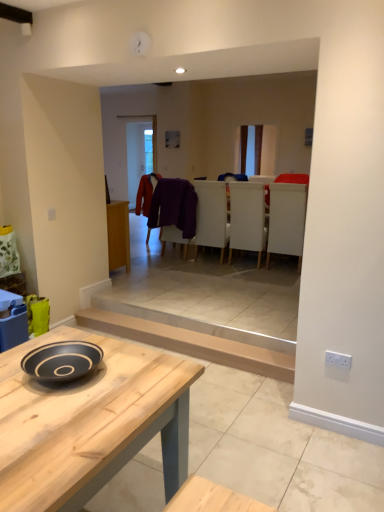
Question: From the image's perspective, does white fabric armchair at center, which is counted as the 2th armchair, starting from the left, appear higher than light brown wooden plank at lower center?

Choices:
 (A) no
 (B) yes

Answer: (B)

Question: Is white fabric armchair at center, which is counted as the 2th armchair, starting from the left, oriented away from light brown wooden plank at lower center?

Choices:
 (A) no
 (B) yes

Answer: (B)

Question: Is white fabric armchair at center, the 1th armchair from the right, further to camera compared to light brown wooden plank at lower center?

Choices:
 (A) no
 (B) yes

Answer: (B)

Question: Does white fabric armchair at center, the 1th armchair from the right, have a greater width compared to light brown wooden plank at lower center?

Choices:
 (A) no
 (B) yes

Answer: (B)

Question: Are white fabric armchair at center, which is counted as the 2th armchair, starting from the left, and light brown wooden plank at lower center located far from each other?

Choices:
 (A) no
 (B) yes

Answer: (B)

Question: Considering the positions of white matte chair at center and natural wood table at center in the image, is white matte chair at center taller or shorter than natural wood table at center?

Choices:
 (A) short
 (B) tall

Answer: (B)

Question: Is white matte chair at center spatially inside natural wood table at center, or outside of it?

Choices:
 (A) outside
 (B) inside

Answer: (A)

Question: From a real-world perspective, is white matte chair at center physically located above or below natural wood table at center?

Choices:
 (A) below
 (B) above

Answer: (B)

Question: Is white matte chair at center wider or thinner than natural wood table at center?

Choices:
 (A) wide
 (B) thin

Answer: (B)

Question: From the image's perspective, is light brown wooden plank at lower center positioned above or below natural wood table at center?

Choices:
 (A) below
 (B) above

Answer: (B)

Question: Based on their sizes in the image, would you say light brown wooden plank at lower center is bigger or smaller than natural wood table at center?

Choices:
 (A) small
 (B) big

Answer: (A)

Question: In the image, is light brown wooden plank at lower center on the left side or the right side of natural wood table at center?

Choices:
 (A) left
 (B) right

Answer: (B)

Question: Considering the positions of light brown wooden plank at lower center and natural wood table at center in the image, is light brown wooden plank at lower center taller or shorter than natural wood table at center?

Choices:
 (A) tall
 (B) short

Answer: (B)

Question: Considering their positions, is velvet red coat at center, the first laundry positioned from the back, located in front of or behind white fabric armchair at center, which is counted as the 2th armchair, starting from the left?

Choices:
 (A) front
 (B) behind

Answer: (B)

Question: Looking at the image, does velvet red coat at center, the first laundry positioned from the back, seem bigger or smaller compared to white fabric armchair at center, the 1th armchair from the right?

Choices:
 (A) big
 (B) small

Answer: (B)